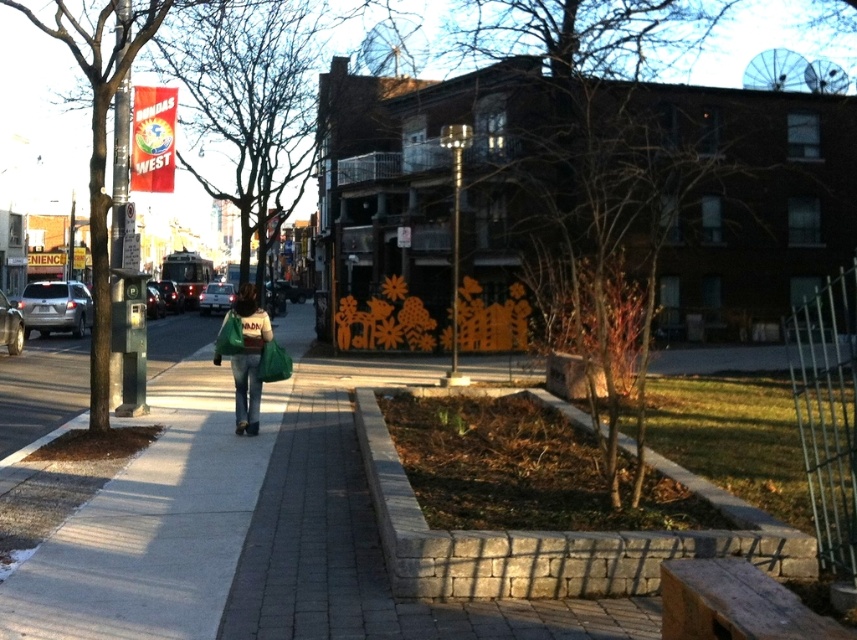
Question: Is stone curb at lower center thinner than green fabric bag at center?

Choices:
 (A) yes
 (B) no

Answer: (A)

Question: Estimate the real-world distances between objects in this image. Which object is farther from the gray concrete sidewalk at center?

Choices:
 (A) green fabric jacket at center
 (B) green fabric bag at center
 (C) stone curb at lower center

Answer: (C)

Question: Is gray concrete sidewalk at center above green fabric bag at center?

Choices:
 (A) no
 (B) yes

Answer: (A)

Question: Does gray concrete sidewalk at center appear under green fabric jacket at center?

Choices:
 (A) no
 (B) yes

Answer: (B)

Question: Which object appears farthest from the camera in this image?

Choices:
 (A) gray concrete sidewalk at center
 (B) green fabric bag at center
 (C) stone curb at lower center
 (D) green fabric jacket at center

Answer: (B)

Question: Which is nearer to the stone curb at lower center?

Choices:
 (A) green fabric jacket at center
 (B) green fabric bag at center
 (C) gray concrete sidewalk at center

Answer: (A)